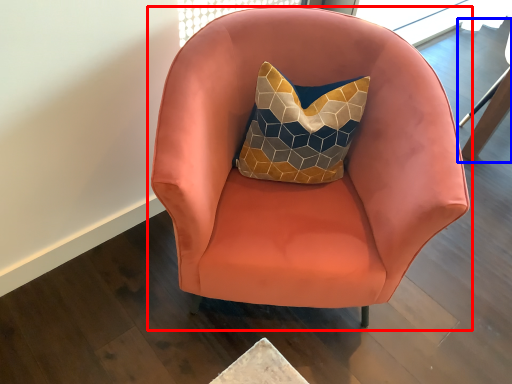
Question: Which of the following is the closest to the observer, chair (highlighted by a red box) or swivel chair (highlighted by a blue box)?

Choices:
 (A) chair
 (B) swivel chair

Answer: (A)